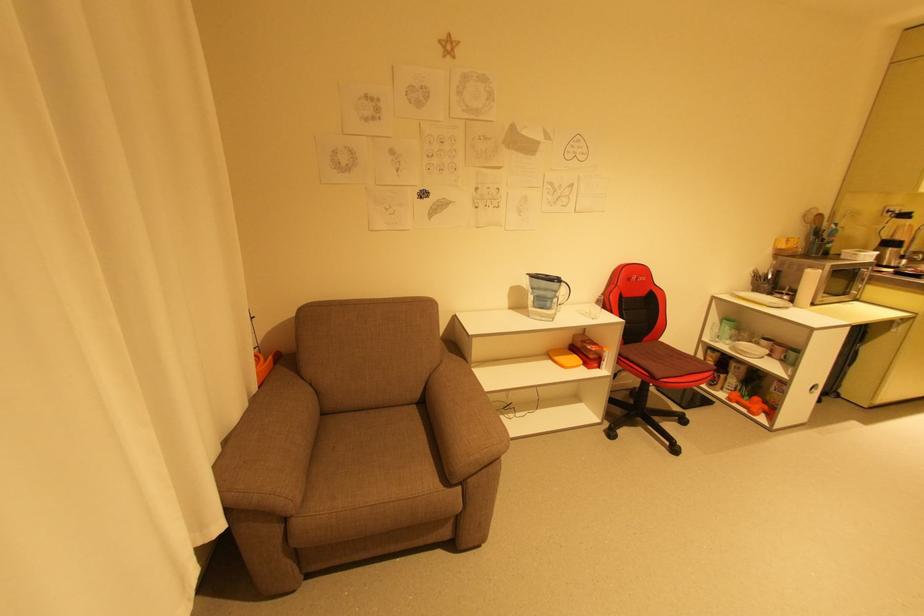
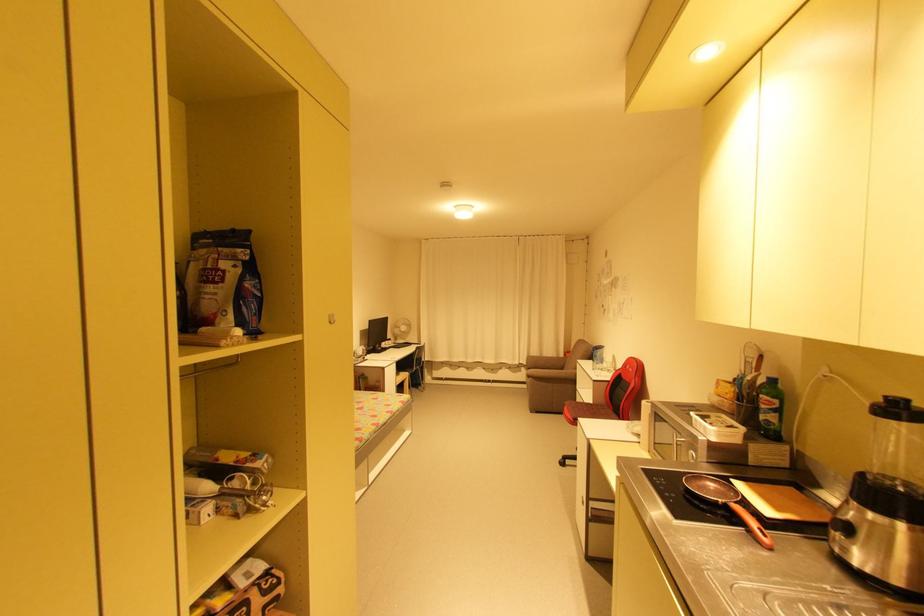
The point at (638, 278) is marked in the first image. Where is the corresponding point in the second image?

(631, 367)